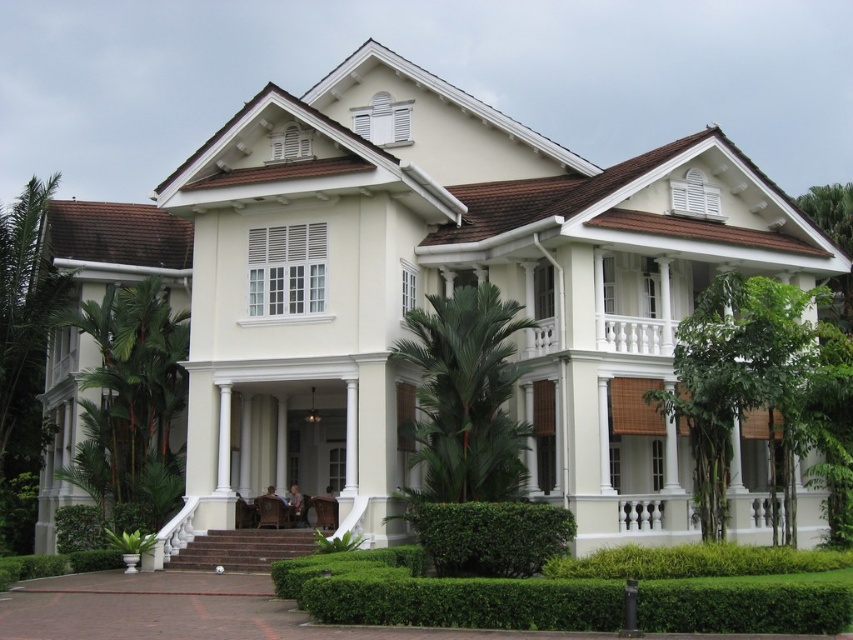
Question: Which object is closer to the camera taking this photo?

Choices:
 (A) green leafy hedge at lower left
 (B) green leafy hedge at lower center

Answer: (B)

Question: Considering the relative positions of green leafy hedge at lower center and green leafy hedge at lower left in the image provided, where is green leafy hedge at lower center located with respect to green leafy hedge at lower left?

Choices:
 (A) right
 (B) left

Answer: (A)

Question: Which point is closer to the camera?

Choices:
 (A) (55, 524)
 (B) (543, 540)

Answer: (B)

Question: Can you confirm if green leafy hedge at lower center is positioned below green leafy hedge at lower left?

Choices:
 (A) yes
 (B) no

Answer: (B)

Question: Does green leafy hedge at lower center appear under green leafy hedge at lower left?

Choices:
 (A) no
 (B) yes

Answer: (A)

Question: Which point appears closest to the camera in this image?

Choices:
 (A) click(x=142, y=532)
 (B) click(x=549, y=508)

Answer: (B)